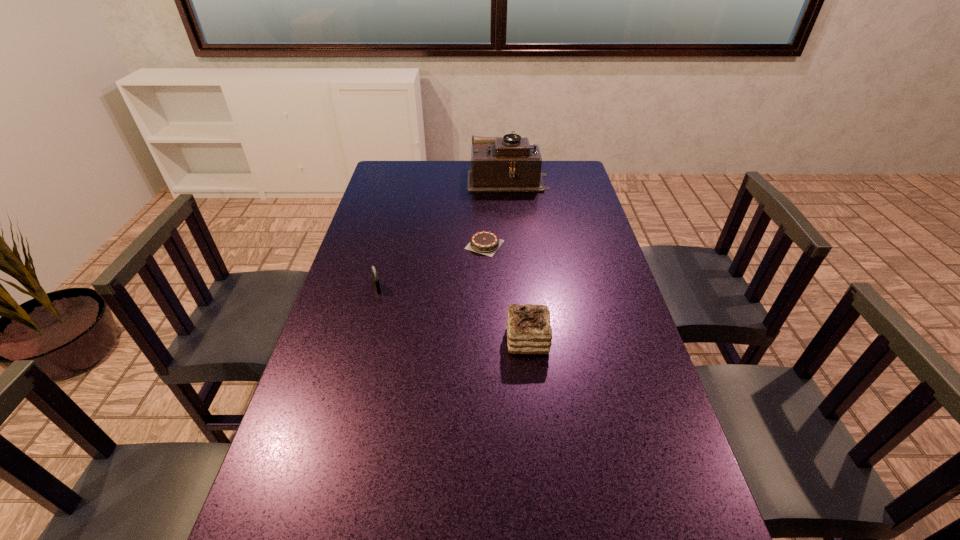
This screenshot has height=540, width=960. I want to click on free space in the image that satisfies the following two spatial constraints: 1. on the horn of the farthest object; 2. on the front side of the third nearest object, so click(x=515, y=245).

The width and height of the screenshot is (960, 540). What are the coordinates of `free space that satisfies the following two spatial constraints: 1. on the back side of the shorter chocolate cake; 2. on the right side of the padlock` in the screenshot? It's located at (389, 245).